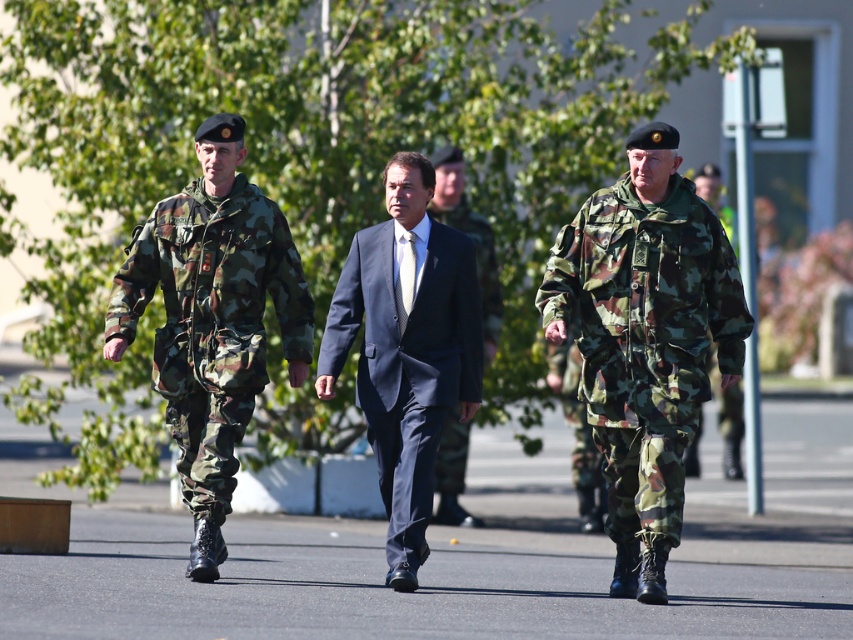
You are a photographer planning to take a group photo of the camouflage fabric uniform at left and the navy blue suit at center. Which of the two should you position closer to the camera to ensure both appear the same size in the photo?

The camouflage fabric uniform at left is larger in size compared to the navy blue suit at center, so you should position the navy blue suit at center closer to the camera to balance their sizes in the photo.